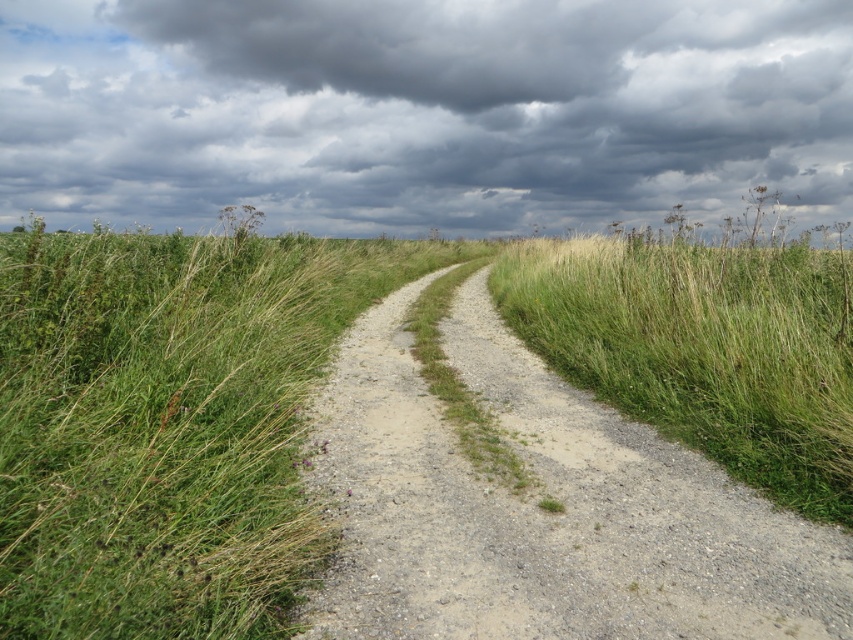
You are a hiker planning to walk along the dusty gravel path at center. You notice a dark gray cloud at upper center in the sky. Based on the scene description, what might this cloud indicate about the weather conditions ahead?

The dark gray cloud at upper center is positioned over the dusty gravel path at center, which might indicate an approaching storm or rain, potentially leading to slippery conditions on the path.

You are standing on the dusty gravel path at center and looking up at the dark gray cloud at upper center. Which object is higher in the sky?

The dark gray cloud at upper center is higher in the sky than the dusty gravel path at center because it has a greater height compared to the dusty gravel path at center.